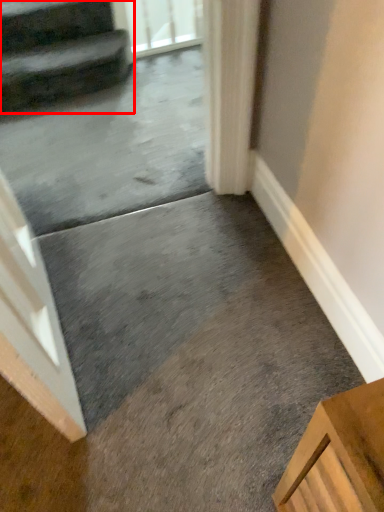
Question: From the image's perspective, where is stairs (annotated by the red box) located in relation to screen door in the image?

Choices:
 (A) below
 (B) above

Answer: (A)